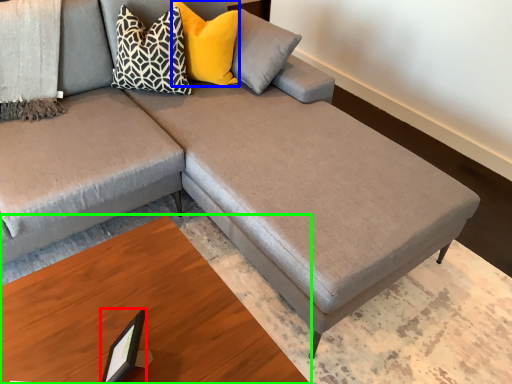
Question: Which object is positioned farthest from picture frame (highlighted by a red box)? Select from pillow (highlighted by a blue box) and table (highlighted by a green box).

Choices:
 (A) pillow
 (B) table

Answer: (A)